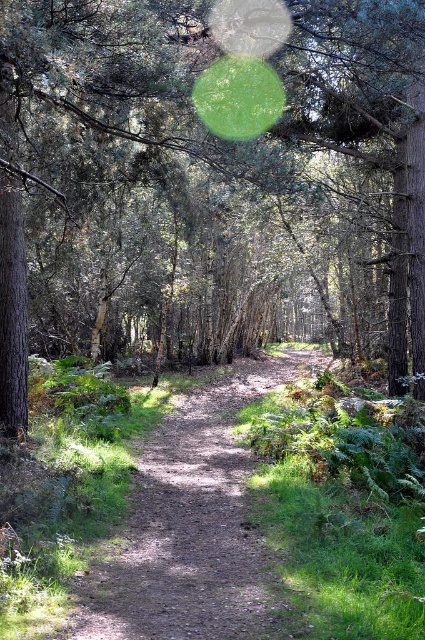
You are a hiker trying to navigate through the forest. You see the green leafy tree at center and the dirt path at center. Which one is higher from the ground?

The green leafy tree at center is taller than the dirt path at center, so the tree is higher from the ground.

You are a hiker walking along the dirt path in the forest. You notice two points marked on the path. The first point is at coordinates point (189, 208) and the second point is at point (184, 557). If you are facing the direction of the path, which point is closer to you?

Point (184, 557) is closer to you because it is in front of point (189, 208) according to their positions on the path.